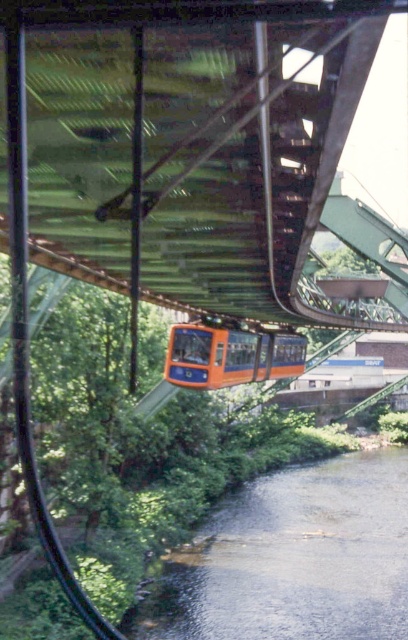
Which is above, clear water at lower center or orange matte train at center?

Positioned higher is orange matte train at center.

From the picture: Does clear water at lower center have a greater height compared to orange matte train at center?

In fact, clear water at lower center may be shorter than orange matte train at center.

Identify the location of clear water at lower center. (294, 557).